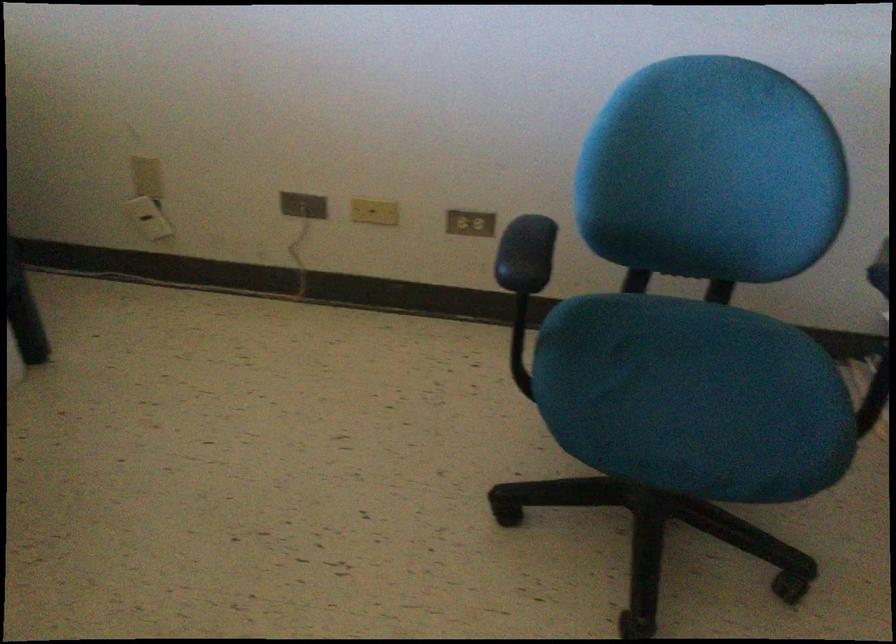
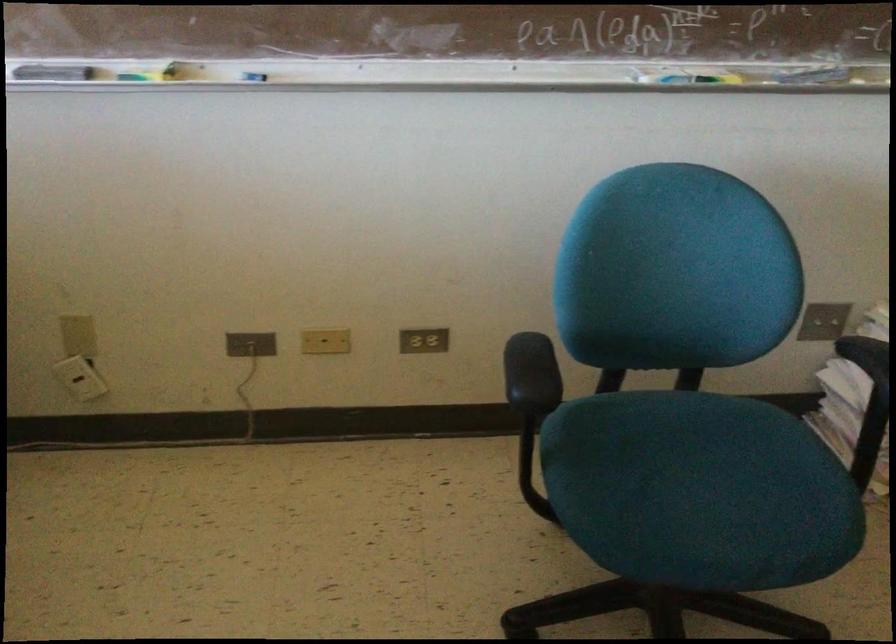
Locate, in the second image, the point that corresponds to point 522,254 in the first image.

(531, 374)